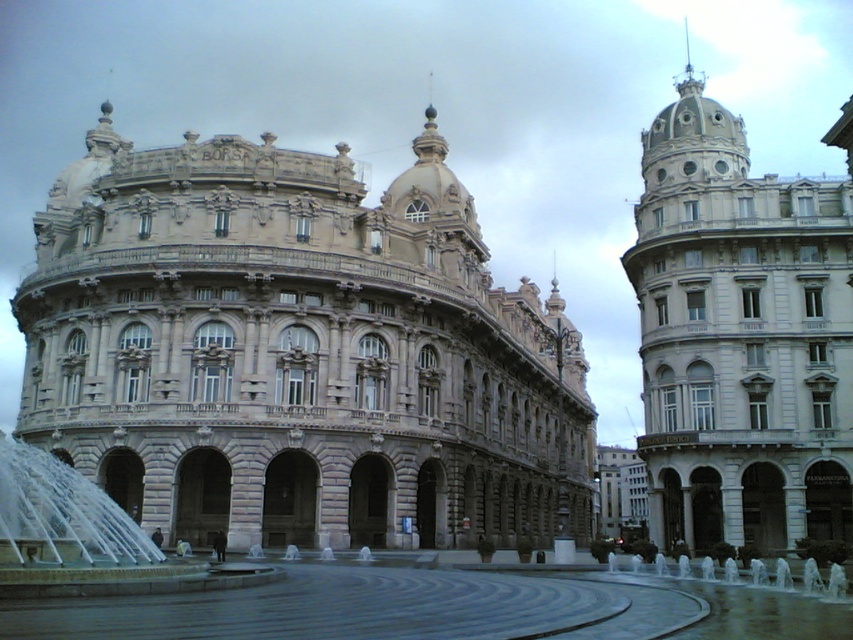
Question: Which object appears closest to the camera in this image?

Choices:
 (A) clear glass water at center
 (B) beige stone building at center

Answer: (A)

Question: Which point is farther to the camera?

Choices:
 (A) beige stone building at center
 (B) clear glass water at center
 (C) white stone tower at upper right

Answer: (C)

Question: Is beige stone building at center below white stone tower at upper right?

Choices:
 (A) no
 (B) yes

Answer: (A)

Question: Where is beige stone building at center located in relation to white stone tower at upper right in the image?

Choices:
 (A) above
 (B) below

Answer: (A)

Question: Which object appears farthest from the camera in this image?

Choices:
 (A) white stone tower at upper right
 (B) beige stone building at center

Answer: (A)

Question: Does beige stone building at center have a lesser width compared to white stone tower at upper right?

Choices:
 (A) yes
 (B) no

Answer: (B)